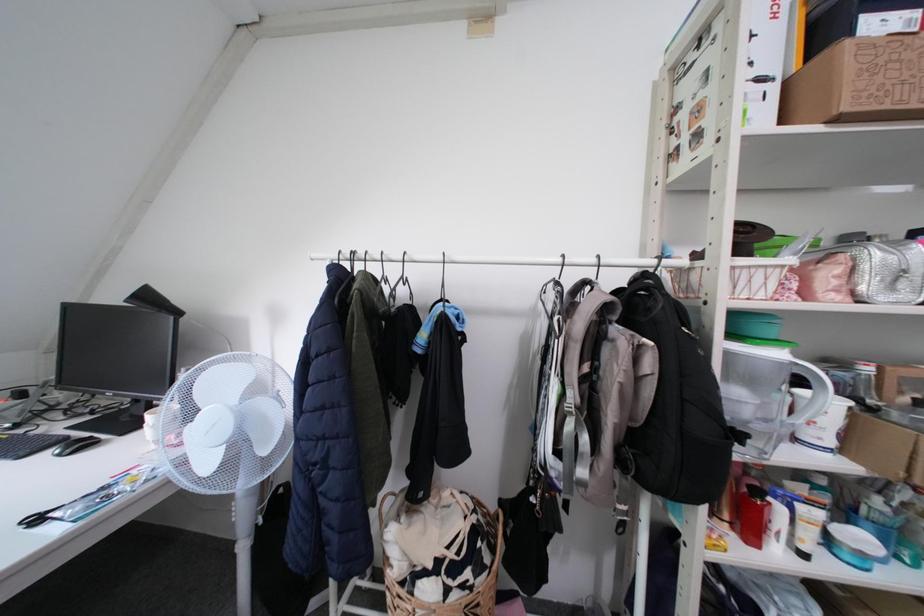
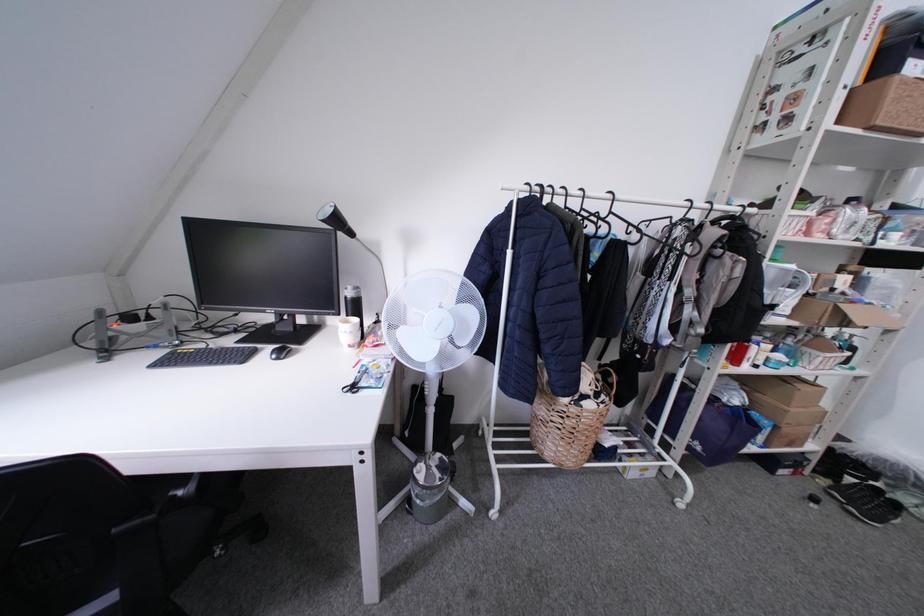
Question: In a continuous first-person perspective shot, in which direction is the camera moving?

Choices:
 (A) Left
 (B) Right
 (C) Forward
 (D) Backward

Answer: (A)